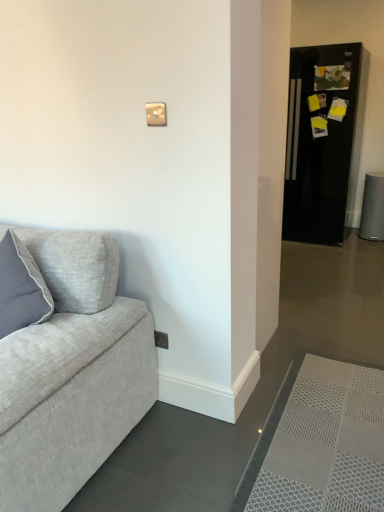
Question: Is black glossy refrigerator at right in front of or behind matte white light switch at upper center in the image?

Choices:
 (A) front
 (B) behind

Answer: (B)

Question: In terms of size, does black glossy refrigerator at right appear bigger or smaller than matte white light switch at upper center?

Choices:
 (A) big
 (B) small

Answer: (A)

Question: Which object is positioned closest to the black glossy refrigerator at right?

Choices:
 (A) matte white light switch at upper center
 (B) white mesh doormat at lower right

Answer: (B)

Question: Considering the real-world distances, which object is closest to the white mesh doormat at lower right?

Choices:
 (A) matte white light switch at upper center
 (B) black glossy refrigerator at right

Answer: (A)